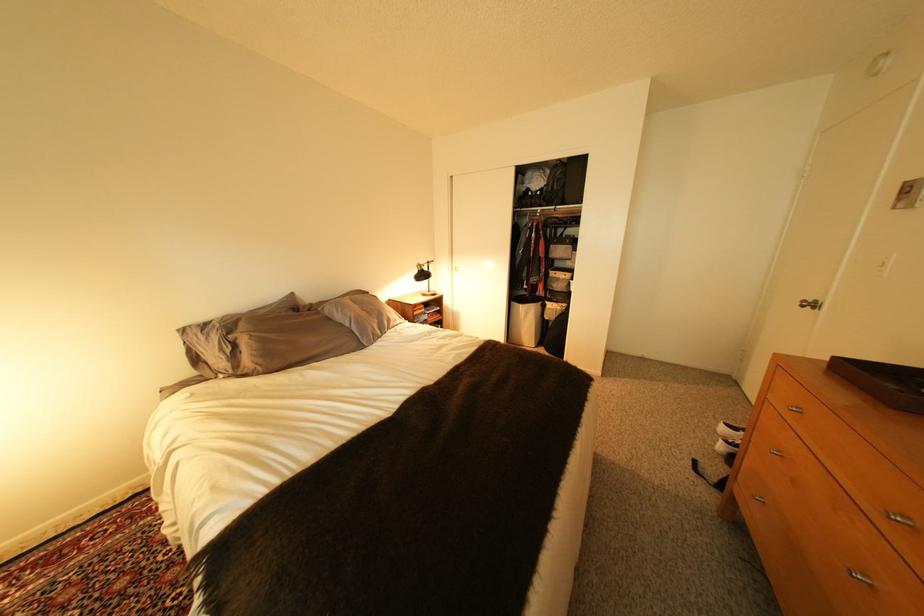
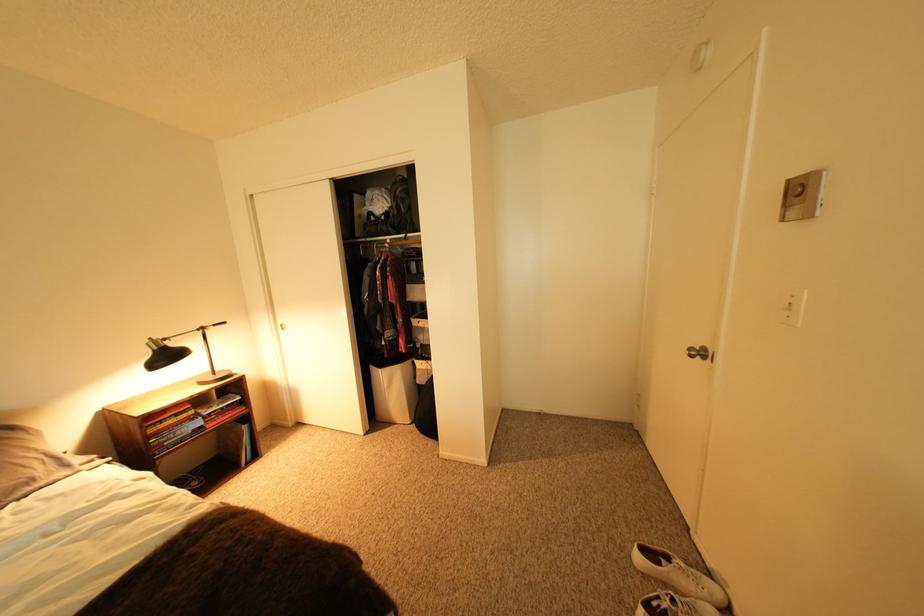
Find the pixel in the second image that matches point 429,273 in the first image.

(165, 353)